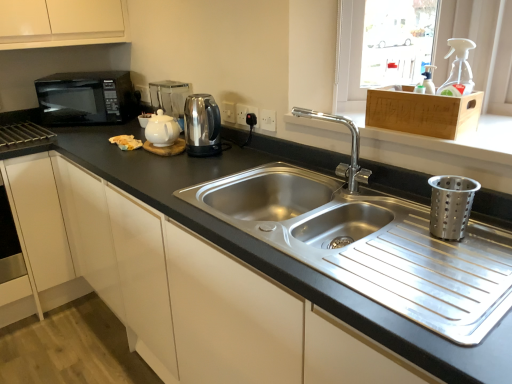
Question: Can you see metallic silver coffee machine at upper center touching black matte microwave at left?

Choices:
 (A) no
 (B) yes

Answer: (A)

Question: Considering the relative sizes of metallic silver coffee machine at upper center and black matte microwave at left in the image provided, is metallic silver coffee machine at upper center taller than black matte microwave at left?

Choices:
 (A) no
 (B) yes

Answer: (A)

Question: From the image's perspective, is metallic silver coffee machine at upper center over black matte microwave at left?

Choices:
 (A) yes
 (B) no

Answer: (B)

Question: Is metallic silver coffee machine at upper center further to the viewer compared to black matte microwave at left?

Choices:
 (A) yes
 (B) no

Answer: (B)

Question: Does metallic silver coffee machine at upper center have a lesser height compared to black matte microwave at left?

Choices:
 (A) yes
 (B) no

Answer: (A)

Question: From the image's perspective, relative to metallic silver coffee machine at upper center, is black matte microwave at left above or below?

Choices:
 (A) above
 (B) below

Answer: (A)

Question: In terms of height, does black matte microwave at left look taller or shorter compared to metallic silver coffee machine at upper center?

Choices:
 (A) tall
 (B) short

Answer: (A)

Question: Does point (65, 102) appear closer or farther from the camera than point (159, 94)?

Choices:
 (A) closer
 (B) farther

Answer: (A)

Question: Based on their sizes in the image, would you say black matte microwave at left is bigger or smaller than metallic silver coffee machine at upper center?

Choices:
 (A) small
 (B) big

Answer: (B)

Question: Is metallic silver coffee machine at upper center inside or outside of white glossy tea pot at center?

Choices:
 (A) outside
 (B) inside

Answer: (A)

Question: Visually, is metallic silver coffee machine at upper center positioned to the left or to the right of white glossy tea pot at center?

Choices:
 (A) right
 (B) left

Answer: (B)

Question: In the image, is metallic silver coffee machine at upper center positioned in front of or behind white glossy tea pot at center?

Choices:
 (A) front
 (B) behind

Answer: (B)

Question: In terms of width, does metallic silver coffee machine at upper center look wider or thinner when compared to white glossy tea pot at center?

Choices:
 (A) wide
 (B) thin

Answer: (B)

Question: In terms of width, does stainless steel kettle at center look wider or thinner when compared to white glossy tea pot at center?

Choices:
 (A) thin
 (B) wide

Answer: (A)

Question: From the image's perspective, is stainless steel kettle at center above or below white glossy tea pot at center?

Choices:
 (A) below
 (B) above

Answer: (A)